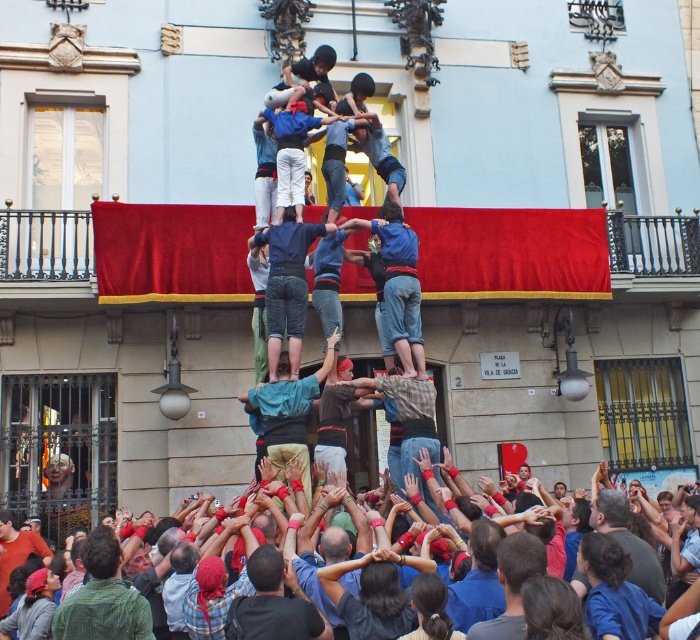
Which is below, blue denim jeans at center or red fabric crowd at center?

red fabric crowd at center

Is blue denim jeans at center shorter than red fabric crowd at center?

Indeed, blue denim jeans at center has a lesser height compared to red fabric crowd at center.

Which is in front, point (301, 272) or point (657, 566)?

Point (657, 566) is in front.

Where is `blue denim jeans at center`? The height and width of the screenshot is (640, 700). blue denim jeans at center is located at coordinates (287, 285).

Does green plaid shirt at lower left have a larger size compared to dark blue shirt at center?

Yes, green plaid shirt at lower left is bigger than dark blue shirt at center.

Does point (112, 561) lie in front of point (280, 570)?

No, it is not.

Find the location of a particular element. This screenshot has width=700, height=640. green plaid shirt at lower left is located at coordinates (104, 596).

Does point (273, 298) come behind point (248, 401)?

Yes, point (273, 298) is farther from viewer.

Is blue denim jeans at center closer to the viewer compared to light blue denim shirt at center?

No, blue denim jeans at center is behind light blue denim shirt at center.

At what (x,y) coordinates should I click in order to perform the action: click on blue denim jeans at center. Please return your answer as a coordinate pair (x, y). Looking at the image, I should click on (287, 285).